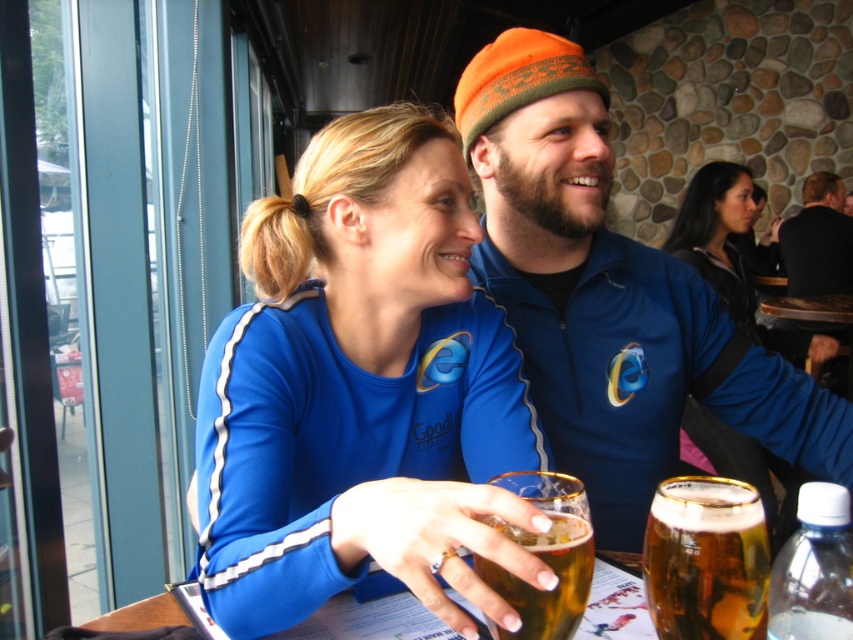
You are a customer at a restaurant and want to place your order. You see two points on the table where you could place your phone. The points are labeled as point (666, 624) and point (521, 595). Which point is located behind the other?

Point (666, 624) is behind point (521, 595).

You are a waiter at the restaurant and need to deliver a dessert to the customer. The dessert needs to be placed on the table without spilling. Considering the blue fabric shirt at center and the translucent glass beer at center, which object should you avoid placing the dessert near to ensure it stays clean?

You should avoid placing the dessert near the translucent glass beer at center because the blue fabric shirt at center is in front of it, meaning the shirt is closer to the dessert placement area. Placing the dessert near the glass beer might risk spills onto the shirt or the dessert itself.

You are a photographer trying to capture a closeup shot of the translucent glass beer at center without including the blue fabric shirt at center in the frame. Given their relative heights, is this possible?

The blue fabric shirt at center has a greater height compared to the translucent glass beer at center. Therefore, it might be challenging to capture the beer without including the shirt in the frame due to its taller stature.